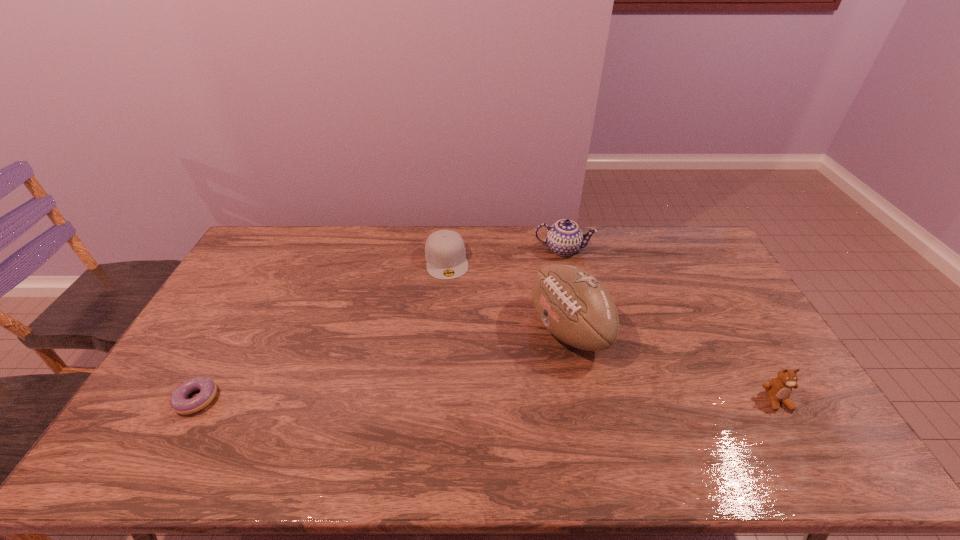
Image resolution: width=960 pixels, height=540 pixels. Find the location of `free space on the desktop that is between the shortest object and the third shortest object and is positioned on the front-facing side of the cap`. free space on the desktop that is between the shortest object and the third shortest object and is positioned on the front-facing side of the cap is located at coordinates (473, 400).

Where is `vacant space on the desktop that is between the leftmost object and the third shortest object and is positioned on the laces of the third nearest object`? This screenshot has width=960, height=540. vacant space on the desktop that is between the leftmost object and the third shortest object and is positioned on the laces of the third nearest object is located at coordinates (420, 400).

The width and height of the screenshot is (960, 540). Find the location of `vacant space on the desktop that is between the doughnut and the third shortest object and is positioned at the spout of the fourth shortest object`. vacant space on the desktop that is between the doughnut and the third shortest object and is positioned at the spout of the fourth shortest object is located at coordinates (544, 400).